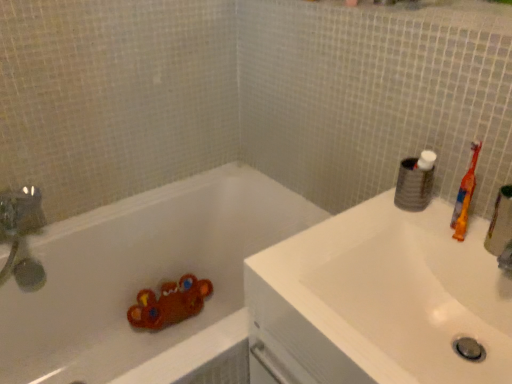
Measure the distance between white matte toilet paper at upper right and camera.

white matte toilet paper at upper right is 38.13 inches away from camera.

Locate an element on the screen. white matte bathtub at lower left is located at coordinates (144, 280).

Is white glossy sink at upper right bigger than white matte toilet paper at upper right?

Yes.

Can you see white glossy sink at upper right touching white matte toilet paper at upper right?

There is a gap between white glossy sink at upper right and white matte toilet paper at upper right.

Considering the sizes of white glossy sink at upper right and white matte toilet paper at upper right in the image, is white glossy sink at upper right wider or thinner than white matte toilet paper at upper right?

Considering their sizes, white glossy sink at upper right looks broader than white matte toilet paper at upper right.

Measure the distance from white glossy sink at upper right to white matte toilet paper at upper right.

white glossy sink at upper right and white matte toilet paper at upper right are 10.90 inches apart from each other.

Between orange plastic toothbrush at right and white matte toilet paper at upper right, which one has more height?

Standing taller between the two is orange plastic toothbrush at right.

Considering the relative positions of orange plastic toothbrush at right and white matte toilet paper at upper right in the image provided, is orange plastic toothbrush at right to the left or to the right of white matte toilet paper at upper right?

orange plastic toothbrush at right is to the right of white matte toilet paper at upper right.

From a real-world perspective, who is located lower, orange plastic toothbrush at right or white matte toilet paper at upper right?

white matte toilet paper at upper right.

Is orange plastic toothbrush at right completely or partially outside of white matte toilet paper at upper right?

Yes, orange plastic toothbrush at right is not within white matte toilet paper at upper right.

Could you tell me if white matte bathtub at lower left is turned towards orange plastic toothbrush at right?

No, white matte bathtub at lower left is not facing towards orange plastic toothbrush at right.

Which is less distant, (181,353) or (474,146)?

Point (181,353) is positioned farther from the camera compared to point (474,146).

Locate an element on the screen. toothbrush lying above the white matte bathtub at lower left (from the image's perspective) is located at coordinates (465, 196).

Can you confirm if white matte bathtub at lower left is taller than orange plastic toothbrush at right?

Yes.

From the image's perspective, between white matte bathtub at lower left and white matte toilet paper at upper right, who is located below?

From the image's view, white matte bathtub at lower left is below.

Find the location of a particular element. The width and height of the screenshot is (512, 384). toilet paper above the white matte bathtub at lower left (from the image's perspective) is located at coordinates (413, 186).

Based on the photo, considering the relative positions of white matte bathtub at lower left and white matte toilet paper at upper right in the image provided, is white matte bathtub at lower left to the right of white matte toilet paper at upper right from the viewer's perspective?

No, white matte bathtub at lower left is not to the right of white matte toilet paper at upper right.

Is there a large distance between white glossy sink at upper right and white matte bathtub at lower left?

No, white glossy sink at upper right is in close proximity to white matte bathtub at lower left.

In the scene shown: Considering the relative sizes of white glossy sink at upper right and white matte bathtub at lower left in the image provided, is white glossy sink at upper right taller than white matte bathtub at lower left?

No.

Can you confirm if white glossy sink at upper right is thinner than white matte bathtub at lower left?

Indeed, white glossy sink at upper right has a lesser width compared to white matte bathtub at lower left.

Does white matte toilet paper at upper right have a smaller size compared to white matte bathtub at lower left?

Yes, white matte toilet paper at upper right is smaller than white matte bathtub at lower left.

From their relative heights in the image, would you say white matte toilet paper at upper right is taller or shorter than white matte bathtub at lower left?

white matte toilet paper at upper right is shorter than white matte bathtub at lower left.

How many degrees apart are the facing directions of white matte toilet paper at upper right and white matte bathtub at lower left?

The angular difference between white matte toilet paper at upper right and white matte bathtub at lower left is 89.8 degrees.

Where is `bathtub on the left of white matte toilet paper at upper right`? bathtub on the left of white matte toilet paper at upper right is located at coordinates click(144, 280).

Can you confirm if white matte toilet paper at upper right is positioned to the left of white glossy sink at upper right?

No, white matte toilet paper at upper right is not to the left of white glossy sink at upper right.

Considering the positions of points (424, 171) and (361, 348), is point (424, 171) closer to camera compared to point (361, 348)?

No, (424, 171) is behind (361, 348).

Is white matte toilet paper at upper right wider or thinner than white glossy sink at upper right?

Clearly, white matte toilet paper at upper right has less width compared to white glossy sink at upper right.

Is white matte toilet paper at upper right outside of white glossy sink at upper right?

Yes, white matte toilet paper at upper right is located beyond the bounds of white glossy sink at upper right.

In the image, there is a white glossy sink at upper right. Find the location of `toilet paper above it (from the image's perspective)`. toilet paper above it (from the image's perspective) is located at coordinates (413, 186).

In the image, there is a orange plastic toothbrush at right. Identify the location of toilet paper below it (from a real-world perspective). This screenshot has height=384, width=512. (413, 186).

Looking at the image, which one is located closer to white matte bathtub at lower left, white glossy sink at upper right or white matte toilet paper at upper right?

white glossy sink at upper right is closer to white matte bathtub at lower left.

From the image, which object appears to be nearer to white glossy sink at upper right, orange plastic toothbrush at right or white matte bathtub at lower left?

orange plastic toothbrush at right is positioned closer to the anchor white glossy sink at upper right.

Looking at the image, which one is located closer to white matte bathtub at lower left, orange plastic toothbrush at right or white matte toilet paper at upper right?

white matte toilet paper at upper right.

In the scene shown: From the image, which object appears to be nearer to white matte toilet paper at upper right, white glossy sink at upper right or white matte bathtub at lower left?

white glossy sink at upper right is positioned closer to the anchor white matte toilet paper at upper right.

Considering their positions, is white glossy sink at upper right positioned further to white matte bathtub at lower left than orange plastic toothbrush at right?

The object further to white matte bathtub at lower left is orange plastic toothbrush at right.

Looking at the image, which one is located further to white matte toilet paper at upper right, white glossy sink at upper right or orange plastic toothbrush at right?

The object further to white matte toilet paper at upper right is white glossy sink at upper right.

Which object lies further to the anchor point white matte toilet paper at upper right, white matte bathtub at lower left or orange plastic toothbrush at right?

Based on the image, white matte bathtub at lower left appears to be further to white matte toilet paper at upper right.

From the image, which object appears to be farther from orange plastic toothbrush at right, white glossy sink at upper right or white matte bathtub at lower left?

white matte bathtub at lower left is positioned further to the anchor orange plastic toothbrush at right.

Find the location of a particular element. This screenshot has height=384, width=512. sink between white matte bathtub at lower left and white matte toilet paper at upper right from left to right is located at coordinates (378, 301).

The height and width of the screenshot is (384, 512). I want to click on sink situated between white matte bathtub at lower left and orange plastic toothbrush at right from left to right, so click(x=378, y=301).

Locate an element on the screen. The height and width of the screenshot is (384, 512). toothbrush positioned between white glossy sink at upper right and white matte toilet paper at upper right from near to far is located at coordinates (465, 196).

At what (x,y) coordinates should I click in order to perform the action: click on toilet paper between white matte bathtub at lower left and orange plastic toothbrush at right from left to right. Please return your answer as a coordinate pair (x, y). This screenshot has width=512, height=384. Looking at the image, I should click on (413, 186).